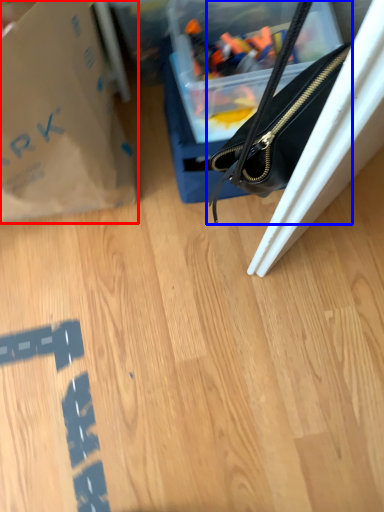
Question: Which object is closer to the camera taking this photo, tote bag (highlighted by a red box) or handbag (highlighted by a blue box)?

Choices:
 (A) tote bag
 (B) handbag

Answer: (A)